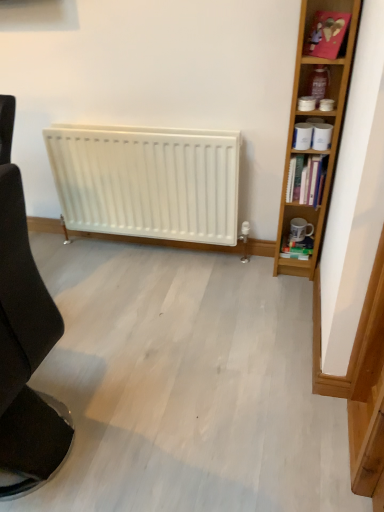
What are the coordinates of `light brown wood bookcase at right` in the screenshot? It's located at (319, 118).

Measure the distance between hardcover books at right and camera.

hardcover books at right is 5.93 feet from camera.

This screenshot has width=384, height=512. What do you see at coordinates (24, 339) in the screenshot?
I see `black fabric chair at left` at bounding box center [24, 339].

Where is `pink cardboard at upper right`? The image size is (384, 512). pink cardboard at upper right is located at coordinates (326, 34).

You are a GUI agent. You are given a task and a screenshot of the screen. Output one action in this format:
    pyautogui.click(x=<x>, y=<y>)
    Task: Click on the light brown wood bookcase at right
    This screenshot has width=384, height=512.
    Given the screenshot: What is the action you would take?
    pyautogui.click(x=319, y=118)

From a real-world perspective, is white glossy mug at right under black fabric chair at left?

Yes.

Which is closer, (297, 230) or (6, 166)?

Point (297, 230) is positioned farther from the camera compared to point (6, 166).

Which object is closer to the camera, white glossy mug at right or black fabric chair at left?

black fabric chair at left is more forward.

From the image's perspective, which one is positioned higher, white glossy mug at right or black fabric chair at left?

white glossy mug at right is shown above in the image.

How far apart are light brown wood bookcase at right and hardcover books at right?

light brown wood bookcase at right is 17.52 centimeters from hardcover books at right.

What's the angular difference between light brown wood bookcase at right and hardcover books at right's facing directions?

The angle between the facing direction of light brown wood bookcase at right and the facing direction of hardcover books at right is 6.69 degrees.

Does point (331, 162) lie in front of point (294, 199)?

Yes, it is.

Is light brown wood bookcase at right outside of hardcover books at right?

Yes.

From the picture: Between matte plastic container at upper right and light brown wood bookcase at right, which one has larger width?

light brown wood bookcase at right.

Relative to light brown wood bookcase at right, is matte plastic container at upper right in front or behind?

matte plastic container at upper right is positioned farther from the viewer than light brown wood bookcase at right.

Does matte plastic container at upper right have a smaller size compared to light brown wood bookcase at right?

Yes.

From the image's perspective, is black fabric chair at left above or below pink cardboard at upper right?

black fabric chair at left is situated lower than pink cardboard at upper right in the image.

How many degrees apart are the facing directions of black fabric chair at left and pink cardboard at upper right?

black fabric chair at left and pink cardboard at upper right are facing 51.4 degrees away from each other.

Is the position of black fabric chair at left more distant than that of pink cardboard at upper right?

That is False.

Which point is more distant from viewer, (15, 328) or (324, 48)?

The point (324, 48) is more distant.

Is hardcover books at right at the left side of matte plastic container at upper right?

Indeed, hardcover books at right is positioned on the left side of matte plastic container at upper right.

Considering the points (292, 176) and (305, 82), which point is behind, point (292, 176) or point (305, 82)?

The point (292, 176) is behind.

Can you confirm if hardcover books at right is smaller than matte plastic container at upper right?

No.

Can you confirm if hardcover books at right is shorter than pink cardboard at upper right?

In fact, hardcover books at right may be taller than pink cardboard at upper right.

From a real-world perspective, is hardcover books at right located beneath pink cardboard at upper right?

Yes.

From the picture: Which point is more forward, (311, 164) or (328, 36)?

Point (328, 36)

Is hardcover books at right far away from pink cardboard at upper right?

No, hardcover books at right is not far from pink cardboard at upper right.

Is black fabric chair at left far away from hardcover books at right?

black fabric chair at left is far away from hardcover books at right.

Which of these two, black fabric chair at left or hardcover books at right, is smaller?

hardcover books at right is smaller.

Looking at this image, is black fabric chair at left facing towards hardcover books at right?

No, black fabric chair at left does not turn towards hardcover books at right.

Relative to hardcover books at right, is black fabric chair at left in front or behind?

In the image, black fabric chair at left appears in front of hardcover books at right.

I want to click on chair on the left of the white glossy mug at right, so click(24, 339).

In order to click on bookcase lying on the right of hardcover books at right in this screenshot , I will do `click(319, 118)`.

Estimate the real-world distances between objects in this image. Which object is closer to matte plastic container at upper right, black fabric chair at left or hardcover books at right?

hardcover books at right is closer to matte plastic container at upper right.

Looking at the image, which one is located closer to pink cardboard at upper right, white glossy mug at right or black fabric chair at left?

Among the two, white glossy mug at right is located nearer to pink cardboard at upper right.

Which object lies nearer to the anchor point white glossy mug at right, light brown wood bookcase at right or black fabric chair at left?

light brown wood bookcase at right lies closer to white glossy mug at right than the other object.

Consider the image. Looking at the image, which one is located further to matte plastic container at upper right, black fabric chair at left or pink cardboard at upper right?

The object further to matte plastic container at upper right is black fabric chair at left.

From the image, which object appears to be farther from black fabric chair at left, light brown wood bookcase at right or white glossy mug at right?

Among the two, white glossy mug at right is located further to black fabric chair at left.

From the image, which object appears to be farther from matte plastic container at upper right, light brown wood bookcase at right or white glossy mug at right?

The object further to matte plastic container at upper right is white glossy mug at right.

Considering their positions, is matte plastic container at upper right positioned closer to hardcover books at right than pink cardboard at upper right?

matte plastic container at upper right lies closer to hardcover books at right than the other object.

Based on their spatial positions, is black fabric chair at left or white glossy mug at right closer to pink cardboard at upper right?

white glossy mug at right.

Locate an element on the screen. This screenshot has width=384, height=512. shelf located between light brown wood bookcase at right and white glossy mug at right in the depth direction is located at coordinates (318, 87).

Locate an element on the screen. cabinet between black fabric chair at left and light brown wood bookcase at right is located at coordinates (326, 34).

Identify the location of bookcase located between black fabric chair at left and white glossy mug at right in the depth direction. (319, 118).

Locate an element on the screen. book between black fabric chair at left and white glossy mug at right from front to back is located at coordinates (306, 180).